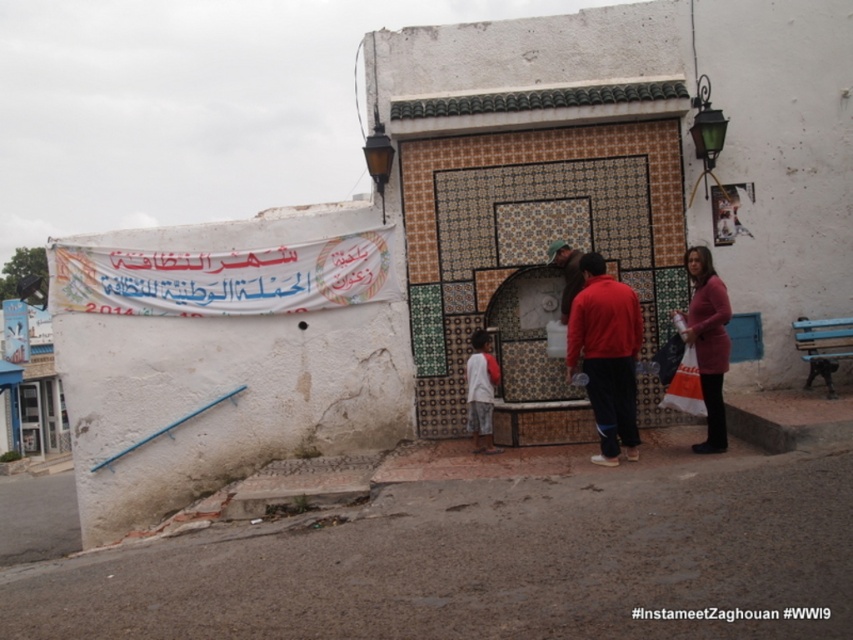
Question: Is white cotton shirt at center wider than brown leather jacket at center?

Choices:
 (A) no
 (B) yes

Answer: (A)

Question: Estimate the real-world distances between objects in this image. Which object is closer to the matte red jacket at center?

Choices:
 (A) white cotton shirt at center
 (B) brown leather jacket at center

Answer: (A)

Question: Which point appears farthest from the camera in this image?

Choices:
 (A) (569, 253)
 (B) (712, 364)
 (C) (488, 380)
 (D) (640, 346)

Answer: (A)

Question: Can you confirm if matte red jacket at center is smaller than pink matte sweater at lower right?

Choices:
 (A) no
 (B) yes

Answer: (A)

Question: Can you confirm if matte red jacket at center is positioned below pink matte sweater at lower right?

Choices:
 (A) no
 (B) yes

Answer: (B)

Question: Which point appears closest to the camera in this image?

Choices:
 (A) (566, 300)
 (B) (708, 342)

Answer: (B)